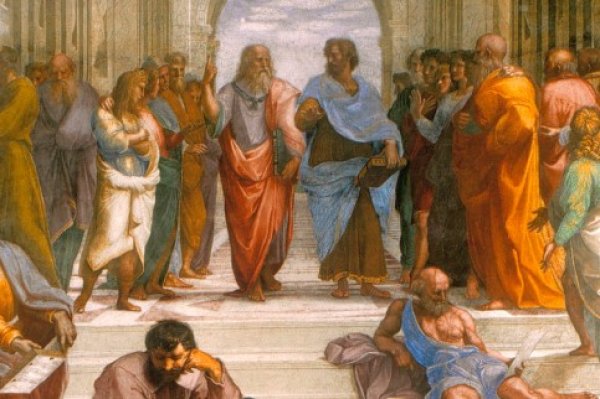
Locate an element on the screen. This screenshot has height=399, width=600. archway is located at coordinates (385, 13).